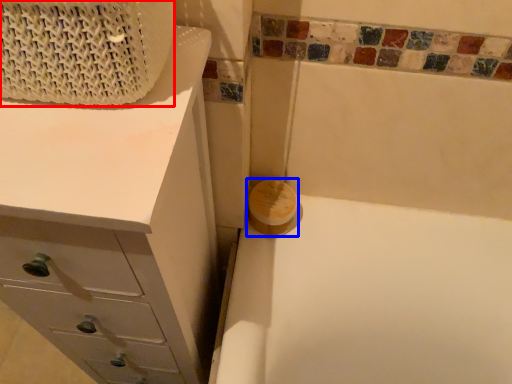
Question: Among these objects, which one is farthest to the camera, basket (highlighted by a red box) or soap (highlighted by a blue box)?

Choices:
 (A) basket
 (B) soap

Answer: (B)